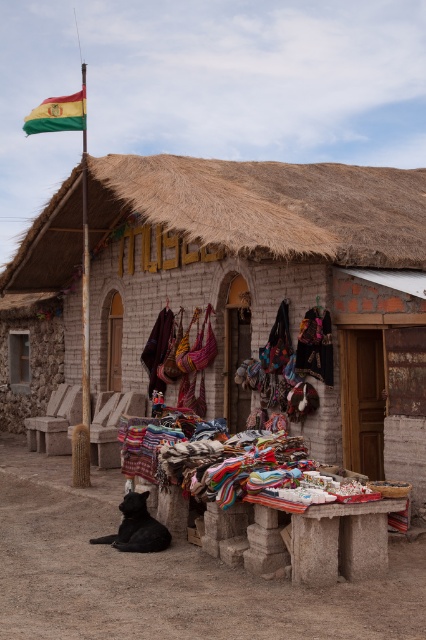
Between thatched straw hut at center and bright yellow-green fabric flag at upper left, which one has less height?

thatched straw hut at center

Which of these two, thatched straw hut at center or bright yellow-green fabric flag at upper left, stands taller?

Standing taller between the two is bright yellow-green fabric flag at upper left.

What do you see at coordinates (271, 285) in the screenshot? I see `thatched straw hut at center` at bounding box center [271, 285].

This screenshot has width=426, height=640. In order to click on thatched straw hut at center in this screenshot , I will do `click(271, 285)`.

Who is higher up, thatched straw hut at center or multicolored woven fabric at center?

Positioned higher is thatched straw hut at center.

Can you confirm if thatched straw hut at center is positioned below multicolored woven fabric at center?

No.

What do you see at coordinates (271, 285) in the screenshot?
I see `thatched straw hut at center` at bounding box center [271, 285].

Identify the location of thatched straw hut at center. The height and width of the screenshot is (640, 426). (271, 285).

Can you confirm if multicolored woven fabric at center is wider than bright yellow-green fabric flag at upper left?

No, multicolored woven fabric at center is not wider than bright yellow-green fabric flag at upper left.

Can you confirm if multicolored woven fabric at center is bigger than bright yellow-green fabric flag at upper left?

Actually, multicolored woven fabric at center might be smaller than bright yellow-green fabric flag at upper left.

This screenshot has width=426, height=640. I want to click on multicolored woven fabric at center, so click(314, 346).